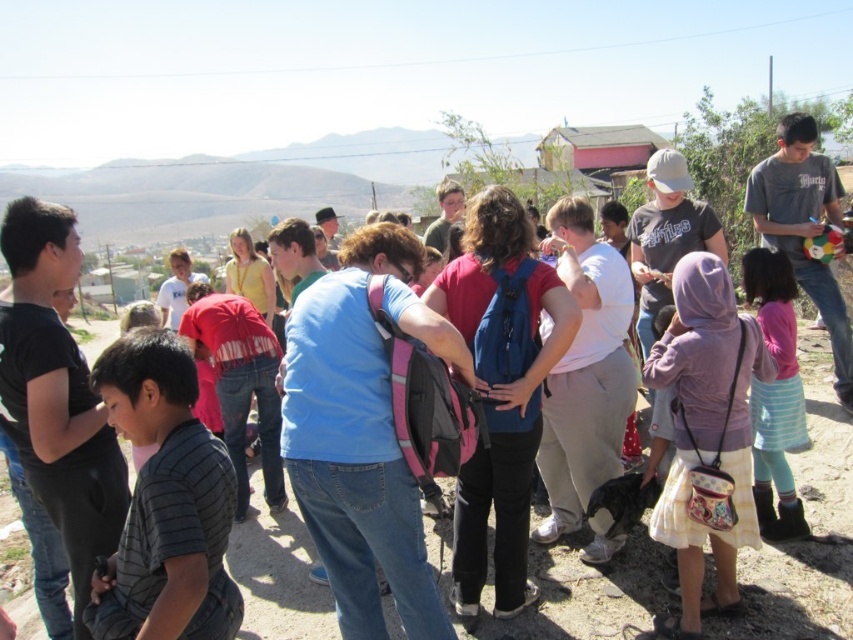
You are a photographer trying to capture a photo of both the purple fabric purse at center and the pink fabric dress at lower right. Which object should you focus on first to ensure both are in focus?

You should focus on the purple fabric purse at center first since it is closer to the viewer than the pink fabric dress at lower right, allowing the camera to adjust focus from near to far to include both in the frame.

You are a photographer trying to capture a photo of the group. You notice the striped cotton shirt at lower left and the pink fabric dress at lower right. Which one is blocking the view of the other?

The striped cotton shirt at lower left is in front of the pink fabric dress at lower right, so it is blocking the view of the pink fabric dress at lower right.